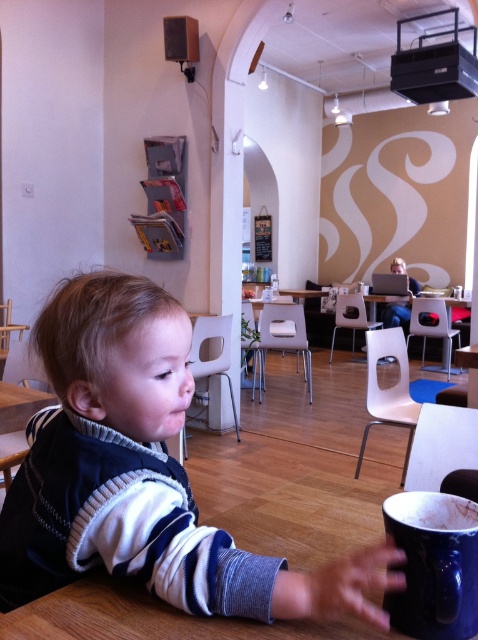
Question: Is dark blue sweater at center positioned before blue ceramic mug at lower right?

Choices:
 (A) no
 (B) yes

Answer: (B)

Question: Which point is closer to the camera taking this photo?

Choices:
 (A) coord(446,544)
 (B) coord(173,480)

Answer: (A)

Question: Observing the image, what is the correct spatial positioning of dark blue sweater at center in reference to blue ceramic mug at lower right?

Choices:
 (A) above
 (B) below

Answer: (A)

Question: Does dark blue sweater at center appear on the left side of blue ceramic mug at lower right?

Choices:
 (A) yes
 (B) no

Answer: (A)

Question: Which of the following is the farthest from the observer?

Choices:
 (A) (415, 532)
 (B) (0, 608)

Answer: (B)